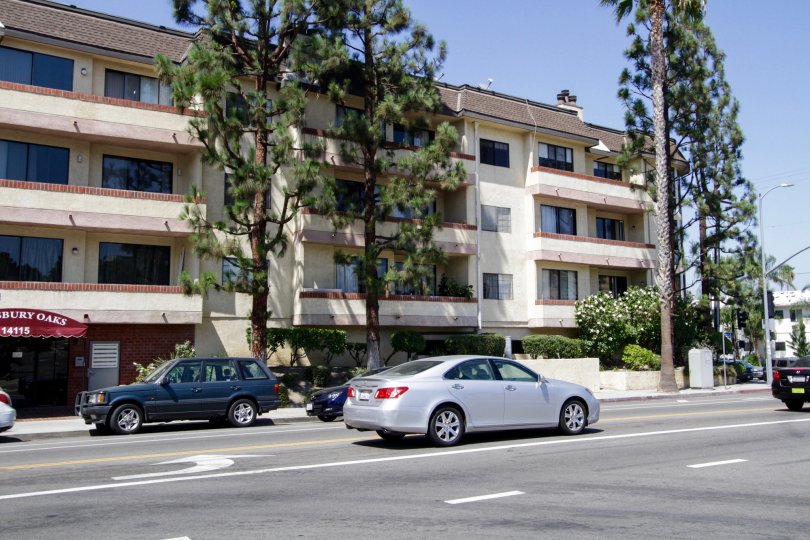
Where is `red canopy`? red canopy is located at coordinates (27, 322).